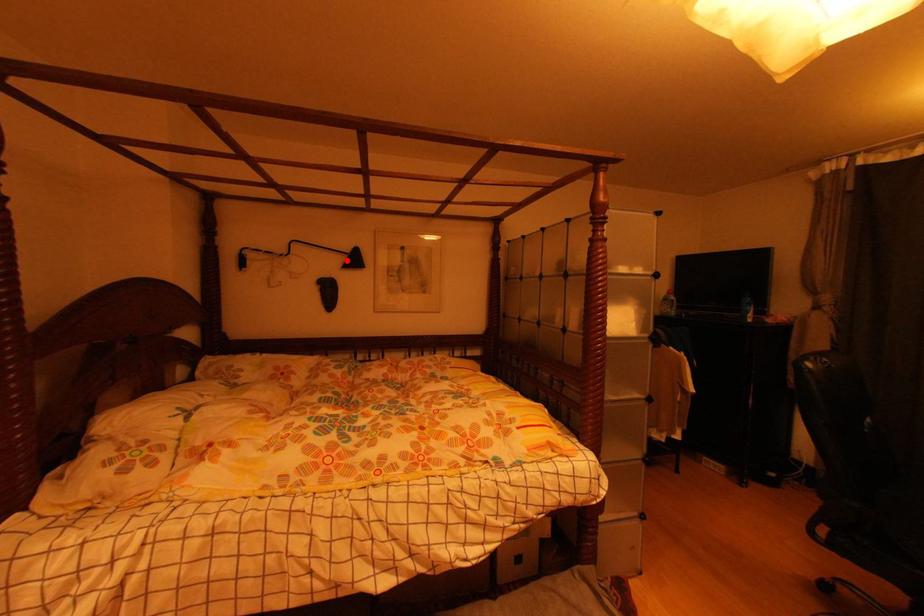
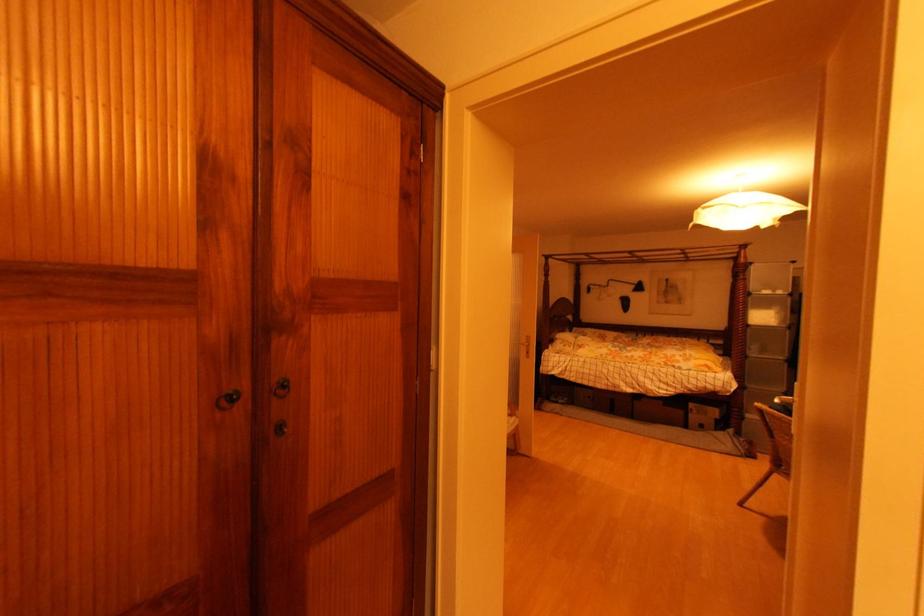
Where in the second image is the point corresponding to the highlighted location from the first image?

(638, 288)